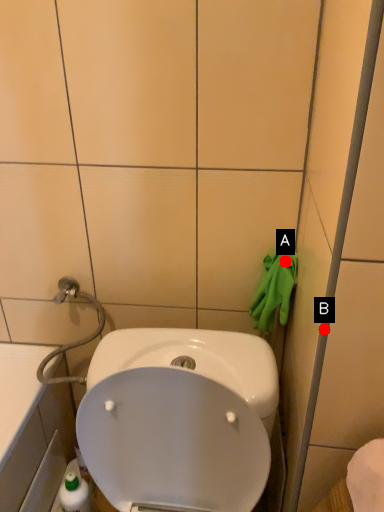
Question: Two points are circled on the image, labeled by A and B beside each circle. Which point appears closest to the camera in this image?

Choices:
 (A) A is closer
 (B) B is closer

Answer: (B)